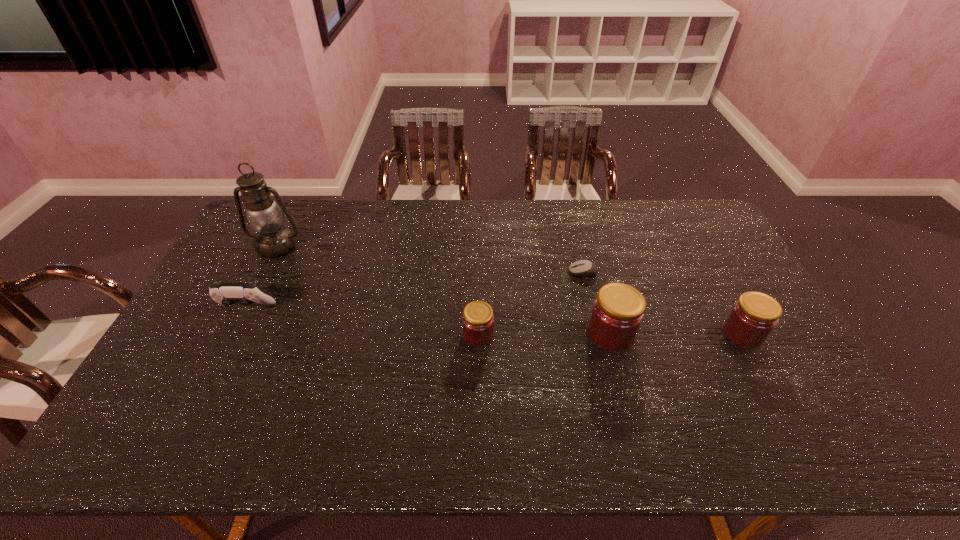
The jams are evenly distributed in the image. To maintain this, where would you place another jam on the left? Please point to a free space. Please provide its 2D coordinates. Your answer should be formatted as a tuple, i.e. [(x, y)], where the tuple contains the x and y coordinates of a point satisfying the conditions above.

[(346, 335)]